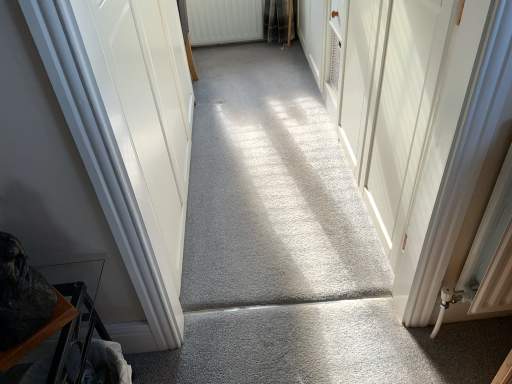
Measure the distance between gray carpet at center and camera.

4.24 feet.

Describe the element at coordinates (325, 348) in the screenshot. Image resolution: width=512 pixels, height=384 pixels. I see `gray carpet at center` at that location.

Where is `gray carpet at center`? This screenshot has height=384, width=512. gray carpet at center is located at coordinates (325, 348).

This screenshot has height=384, width=512. Identify the location of white textured radiator at upper center. (224, 21).

Measure the distance between point (x=203, y=38) and camera.

3.30 meters.

Image resolution: width=512 pixels, height=384 pixels. Describe the element at coordinates (224, 21) in the screenshot. I see `white textured radiator at upper center` at that location.

Image resolution: width=512 pixels, height=384 pixels. In order to click on gray carpet at center in this screenshot , I will do `click(325, 348)`.

Between white textured radiator at upper center and gray carpet at center, which one appears on the left side from the viewer's perspective?

Positioned to the left is white textured radiator at upper center.

Which object is further away from the camera taking this photo, white textured radiator at upper center or gray carpet at center?

white textured radiator at upper center is further away from the camera.

Which is nearer, (190,31) or (342,368)?

Point (342,368)

From the image's perspective, between white textured radiator at upper center and gray carpet at center, who is located below?

gray carpet at center, from the image's perspective.

From the picture: From a real-world perspective, is white textured radiator at upper center located beneath gray carpet at center?

No.

Looking at their sizes, would you say white textured radiator at upper center is wider or thinner than gray carpet at center?

Clearly, white textured radiator at upper center has less width compared to gray carpet at center.

Does white textured radiator at upper center have a lesser height compared to gray carpet at center?

No, white textured radiator at upper center is not shorter than gray carpet at center.

Which of these two, white textured radiator at upper center or gray carpet at center, is smaller?

gray carpet at center.

Is white textured radiator at upper center positioned beyond the bounds of gray carpet at center?

white textured radiator at upper center is positioned outside gray carpet at center.

Are white textured radiator at upper center and gray carpet at center located far from each other?

Indeed, white textured radiator at upper center is not near gray carpet at center.

Is white textured radiator at upper center facing away from gray carpet at center?

That's not correct — white textured radiator at upper center is not looking away from gray carpet at center.

How many degrees apart are the facing directions of white textured radiator at upper center and gray carpet at center?

91.1 degrees separate the facing orientations of white textured radiator at upper center and gray carpet at center.

I want to click on concrete located on the right of white textured radiator at upper center, so click(x=325, y=348).

Is gray carpet at center at the right side of white textured radiator at upper center?

Yes.

Does gray carpet at center lie behind white textured radiator at upper center?

No, gray carpet at center is closer to the camera.

Is point (328, 347) behind point (248, 2)?

No.

From the image's perspective, is gray carpet at center located above white textured radiator at upper center?

Actually, gray carpet at center appears below white textured radiator at upper center in the image.

From a real-world perspective, is gray carpet at center above or below white textured radiator at upper center?

gray carpet at center is below white textured radiator at upper center.

Does gray carpet at center have a lesser width compared to white textured radiator at upper center?

Incorrect, the width of gray carpet at center is not less than that of white textured radiator at upper center.

Is gray carpet at center taller or shorter than white textured radiator at upper center?

Considering their sizes, gray carpet at center has less height than white textured radiator at upper center.

Who is smaller, gray carpet at center or white textured radiator at upper center?

gray carpet at center is smaller.

Would you say gray carpet at center is inside or outside white textured radiator at upper center?

gray carpet at center is outside white textured radiator at upper center.

In the scene shown: Is gray carpet at center not near white textured radiator at upper center?

Indeed, gray carpet at center is not near white textured radiator at upper center.

Could you tell me if gray carpet at center is turned towards white textured radiator at upper center?

No, gray carpet at center is not turned towards white textured radiator at upper center.

From the picture: What's the angular difference between gray carpet at center and white textured radiator at upper center's facing directions?

There is a 91.1-degree angle between the facing directions of gray carpet at center and white textured radiator at upper center.

The width and height of the screenshot is (512, 384). Identify the location of radiator on the left side of gray carpet at center. (224, 21).

Where is `radiator on the left of gray carpet at center`? radiator on the left of gray carpet at center is located at coordinates (x=224, y=21).

Locate an element on the screen. This screenshot has height=384, width=512. concrete lying in front of the white textured radiator at upper center is located at coordinates (325, 348).